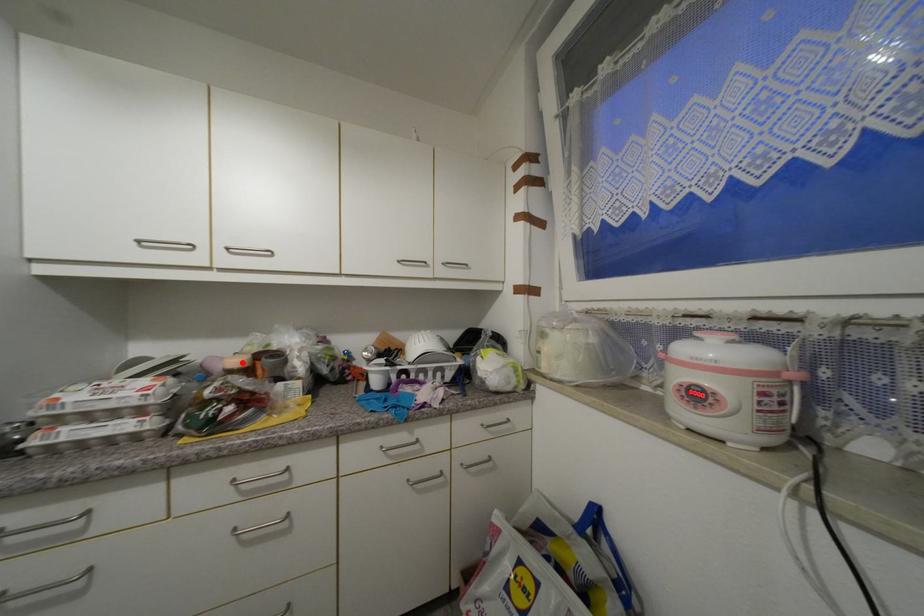
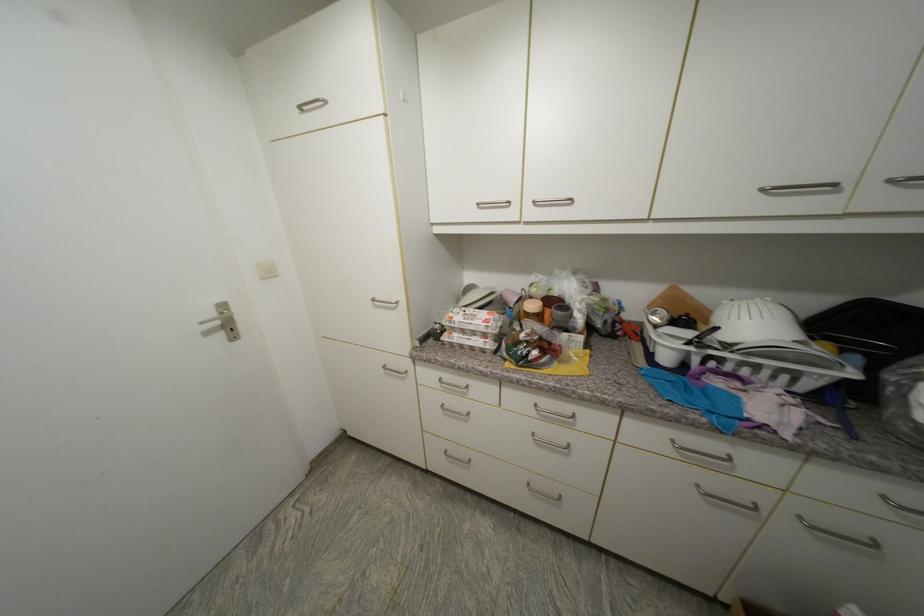
Find the pixel in the second image that matches the highlighted location in the first image.

(538, 307)